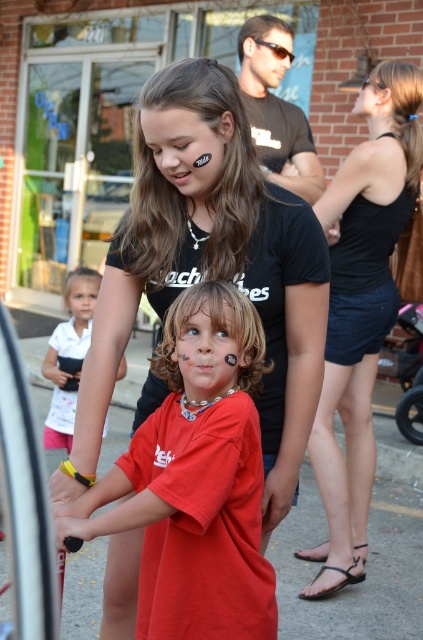
You are a photographer trying to capture a photo of both children in the scene. Since the matte black shirt at center and the matte red shirt at center are overlapping, which child should you ask to move slightly to the side to ensure both are fully visible in the photo?

The matte black shirt at center is positioned over the matte red shirt at center, so you should ask the child wearing the matte black shirt at center to move slightly to the side to ensure both are fully visible in the photo.

You are a photographer trying to capture a candid shot of the two children in the scene. You notice the black denim shorts at lower right and the white matte shirt at lower left. Which object is positioned higher in the frame?

The black denim shorts at lower right is much taller than the white matte shirt at lower left, so it is positioned higher in the frame.

You are a photographer at the event and want to capture a photo that includes both the matte black shirt at center and the white matte shirt at lower left. Which shirt should you focus on first to ensure both are in the frame?

The matte black shirt at center is positioned over the white matte shirt at lower left, so you should focus on the matte black shirt at center first to ensure both are in the frame.